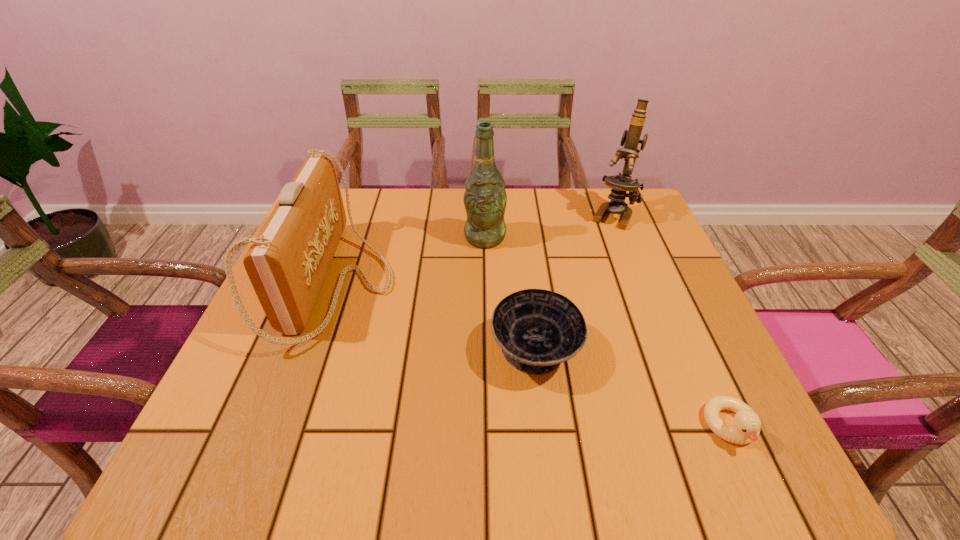
The width and height of the screenshot is (960, 540). What are the coordinates of `object situated at the near right corner` in the screenshot? It's located at (746, 428).

Where is `vacant space at the far edge of the desktop`? vacant space at the far edge of the desktop is located at coordinates (381, 203).

Identify the location of vacant region at the near edge of the desktop. (420, 443).

In the image, there is a desktop. Where is `vacant area at the right edge`? The height and width of the screenshot is (540, 960). vacant area at the right edge is located at coordinates (661, 342).

Where is `vacant point at the far left corner`? The height and width of the screenshot is (540, 960). vacant point at the far left corner is located at coordinates (359, 222).

Locate an element on the screen. This screenshot has width=960, height=540. vacant space at the near left corner of the desktop is located at coordinates (252, 460).

The width and height of the screenshot is (960, 540). In order to click on vacant space at the far right corner in this screenshot , I will do `click(608, 197)`.

The height and width of the screenshot is (540, 960). I want to click on free space between the third tallest object and the fourth tallest object, so click(437, 317).

You are a GUI agent. You are given a task and a screenshot of the screen. Output one action in this format:
    pyautogui.click(x=<x>, y=<y>)
    Task: Click on the vacant region between the duckling and the beer bottle
    This screenshot has height=540, width=960.
    Given the screenshot: What is the action you would take?
    pyautogui.click(x=608, y=332)

Where is `free spot between the handbag and the bowl`? Image resolution: width=960 pixels, height=540 pixels. free spot between the handbag and the bowl is located at coordinates (437, 317).